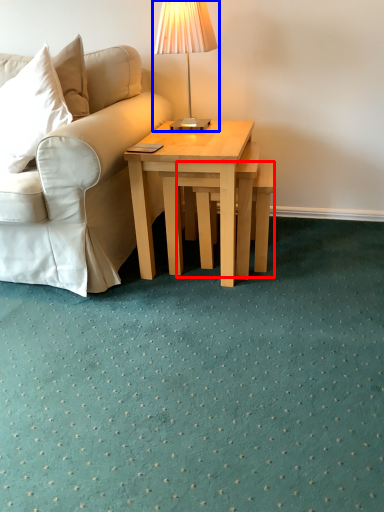
Question: Among these objects, which one is nearest to the camera, stool (highlighted by a red box) or table lamp (highlighted by a blue box)?

Choices:
 (A) stool
 (B) table lamp

Answer: (B)